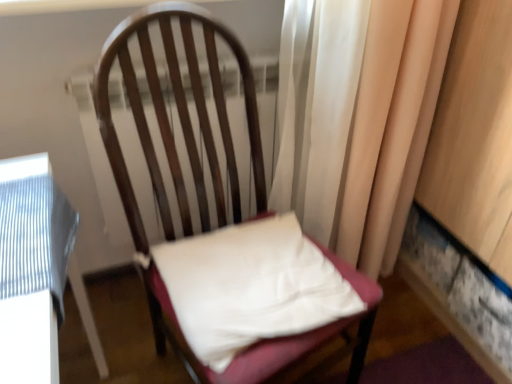
Question: Can you confirm if silky beige curtain at right is positioned to the right of white fabric pillow at center?

Choices:
 (A) yes
 (B) no

Answer: (A)

Question: Considering the relative sizes of silky beige curtain at right and white fabric pillow at center in the image provided, is silky beige curtain at right thinner than white fabric pillow at center?

Choices:
 (A) yes
 (B) no

Answer: (A)

Question: Is silky beige curtain at right surrounding white fabric pillow at center?

Choices:
 (A) no
 (B) yes

Answer: (A)

Question: Considering the relative positions of silky beige curtain at right and white fabric pillow at center in the image provided, is silky beige curtain at right to the left of white fabric pillow at center from the viewer's perspective?

Choices:
 (A) yes
 (B) no

Answer: (B)

Question: Is silky beige curtain at right further to camera compared to white fabric pillow at center?

Choices:
 (A) yes
 (B) no

Answer: (A)

Question: Relative to silky beige curtain at right, is wooden chair at center in front or behind?

Choices:
 (A) front
 (B) behind

Answer: (A)

Question: From a real-world perspective, relative to silky beige curtain at right, is wooden chair at center vertically above or below?

Choices:
 (A) above
 (B) below

Answer: (B)

Question: In terms of height, does wooden chair at center look taller or shorter compared to silky beige curtain at right?

Choices:
 (A) short
 (B) tall

Answer: (A)

Question: In terms of size, does wooden chair at center appear bigger or smaller than silky beige curtain at right?

Choices:
 (A) small
 (B) big

Answer: (B)

Question: Is white fabric pillow at center to the left or to the right of wooden chair at center in the image?

Choices:
 (A) right
 (B) left

Answer: (A)

Question: In the image, is white fabric pillow at center positioned in front of or behind wooden chair at center?

Choices:
 (A) front
 (B) behind

Answer: (B)

Question: From a real-world perspective, relative to wooden chair at center, is white fabric pillow at center vertically above or below?

Choices:
 (A) above
 (B) below

Answer: (B)

Question: In terms of height, does white fabric pillow at center look taller or shorter compared to wooden chair at center?

Choices:
 (A) short
 (B) tall

Answer: (A)

Question: Choose the correct answer: Is wooden chair at center inside white fabric pillow at center or outside it?

Choices:
 (A) inside
 (B) outside

Answer: (B)

Question: From their relative heights in the image, would you say wooden chair at center is taller or shorter than white fabric pillow at center?

Choices:
 (A) short
 (B) tall

Answer: (B)